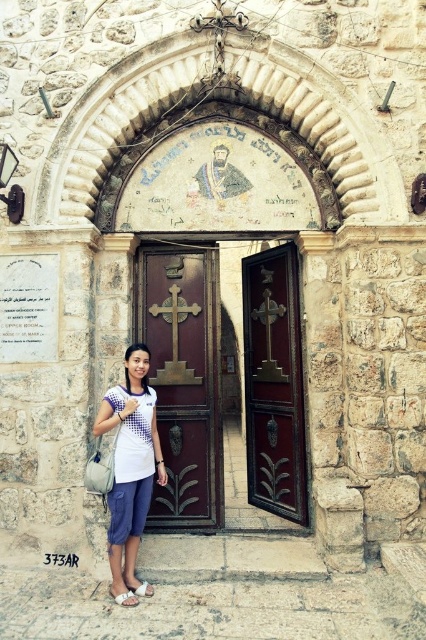
Question: Is brown polished wood door at center positioned behind white cotton shirt at lower center?

Choices:
 (A) yes
 (B) no

Answer: (A)

Question: Which point is farther from the camera taking this photo?

Choices:
 (A) (108, 420)
 (B) (154, 346)
 (C) (245, 381)
 (D) (216, 339)

Answer: (C)

Question: Among these points, which one is nearest to the camera?

Choices:
 (A) (118, 570)
 (B) (170, 500)
 (C) (152, 280)
 (D) (284, 358)

Answer: (A)

Question: Observing the image, what is the correct spatial positioning of dark wood door at center in reference to white cotton shirt at lower center?

Choices:
 (A) left
 (B) right

Answer: (B)

Question: Based on their relative distances, which object is farther from the brown polished wood door at center?

Choices:
 (A) dark brown wood door at center
 (B) dark wood door at center
 (C) white cotton shirt at lower center

Answer: (C)

Question: Can you confirm if dark brown wood door at center is positioned above dark wood door at center?

Choices:
 (A) yes
 (B) no

Answer: (B)